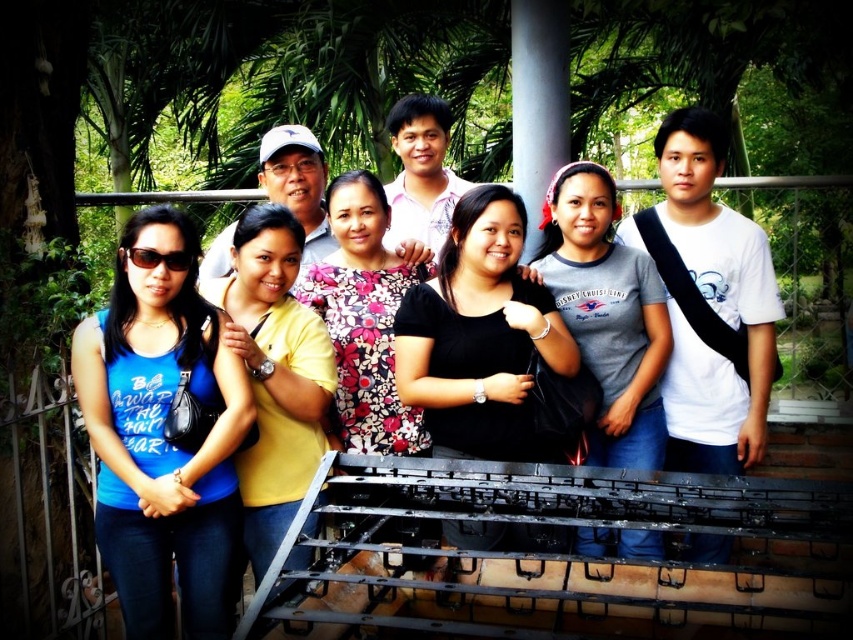
Between yellow matte shirt at center and floral-patterned blouse at center, which one appears on the left side from the viewer's perspective?

yellow matte shirt at center is more to the left.

How much distance is there between yellow matte shirt at center and floral-patterned blouse at center?

A distance of 15.31 inches exists between yellow matte shirt at center and floral-patterned blouse at center.

You are a GUI agent. You are given a task and a screenshot of the screen. Output one action in this format:
    pyautogui.click(x=<x>, y=<y>)
    Task: Click on the yellow matte shirt at center
    The width and height of the screenshot is (853, 640).
    Given the screenshot: What is the action you would take?
    [274, 372]

In the scene shown: Does blue matte tank top at left have a smaller size compared to black matte shirt at center?

Actually, blue matte tank top at left might be larger than black matte shirt at center.

Which is behind, point (71, 353) or point (471, 352)?

Point (471, 352)

The height and width of the screenshot is (640, 853). Find the location of `blue matte tank top at left`. blue matte tank top at left is located at coordinates (161, 433).

Who is more forward, (x=489, y=422) or (x=265, y=513)?

Point (x=265, y=513) is in front.

Which is behind, point (444, 404) or point (265, 262)?

Positioned behind is point (444, 404).

What do you see at coordinates (480, 337) in the screenshot? I see `black matte shirt at center` at bounding box center [480, 337].

Identify the location of black matte shirt at center. (480, 337).